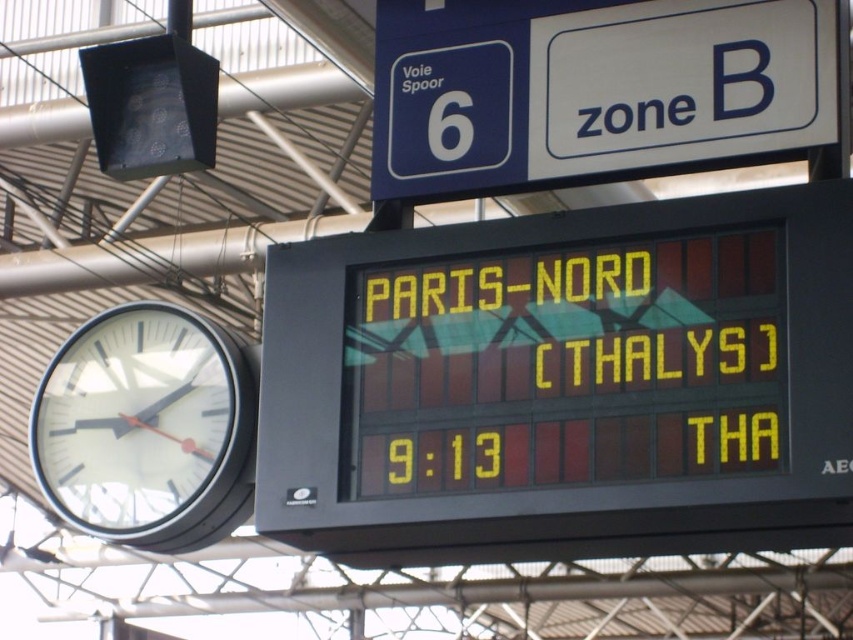
Question: Does blue plastic sign at upper center appear on the left side of white glossy clock at left?

Choices:
 (A) yes
 (B) no

Answer: (B)

Question: Which point appears farthest from the camera in this image?

Choices:
 (A) (653, 374)
 (B) (744, 38)

Answer: (B)

Question: Considering the relative positions of blue plastic sign at upper center and white glossy clock at left in the image provided, where is blue plastic sign at upper center located with respect to white glossy clock at left?

Choices:
 (A) above
 (B) below

Answer: (A)

Question: Estimate the real-world distances between objects in this image. Which object is farther from the yellow led display at center?

Choices:
 (A) white glossy clock at left
 (B) blue plastic sign at upper center

Answer: (A)

Question: Which object appears farthest from the camera in this image?

Choices:
 (A) blue plastic sign at upper center
 (B) white glossy clock at left

Answer: (B)

Question: Can you confirm if blue plastic sign at upper center is positioned below white glossy clock at left?

Choices:
 (A) no
 (B) yes

Answer: (A)